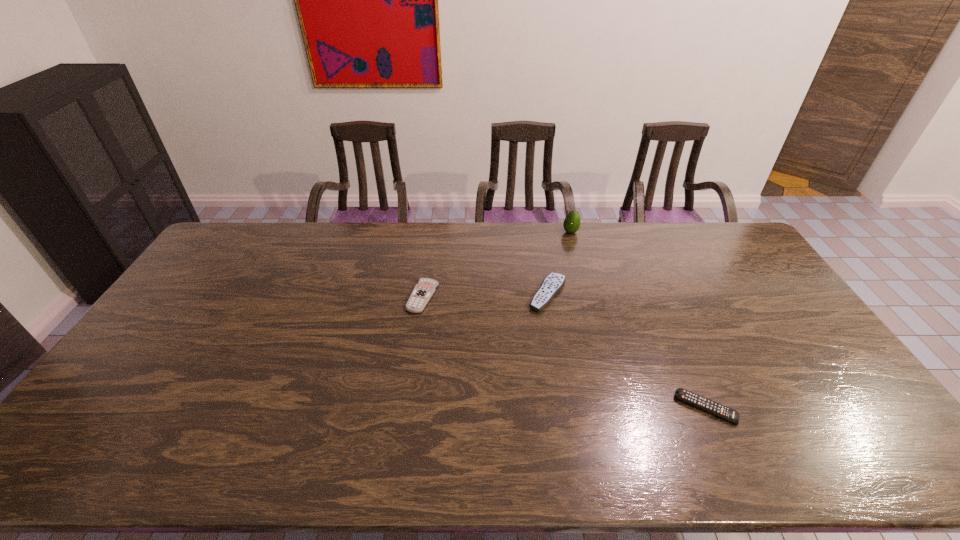
Identify the location of avocado. The image size is (960, 540). (572, 222).

Image resolution: width=960 pixels, height=540 pixels. Find the location of `the tallest object`. the tallest object is located at coordinates (572, 222).

Identify the location of the second tallest object. (553, 283).

Where is `the second remote control from right to left`? Image resolution: width=960 pixels, height=540 pixels. the second remote control from right to left is located at coordinates (553, 283).

You are a GUI agent. You are given a task and a screenshot of the screen. Output one action in this format:
    pyautogui.click(x=<x>, y=<y>)
    Task: Click on the leftmost remote control
    This screenshot has height=540, width=960.
    Given the screenshot: What is the action you would take?
    pyautogui.click(x=423, y=291)

The width and height of the screenshot is (960, 540). Identify the location of the rightmost remote control. click(x=682, y=394).

Find the location of a particular element. the nearest object is located at coordinates [x=682, y=394].

The width and height of the screenshot is (960, 540). What are the coordinates of `vacant region located on the right of the second object from right to left` in the screenshot? It's located at (617, 232).

I want to click on vacant space located 0.100m on the right of the tallest remote control, so click(x=599, y=294).

The width and height of the screenshot is (960, 540). Identify the location of vacant space located 0.330m on the right of the leftmost remote control. (539, 297).